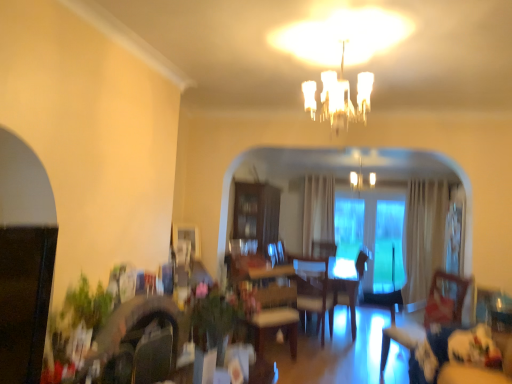
Question: From a real-world perspective, does wooden swivel chair at lower right sit lower than light brown leather armchair at center?

Choices:
 (A) yes
 (B) no

Answer: (B)

Question: Is wooden swivel chair at lower right at the left side of light brown leather armchair at center?

Choices:
 (A) yes
 (B) no

Answer: (B)

Question: Would you say wooden swivel chair at lower right is a long distance from light brown leather armchair at center?

Choices:
 (A) yes
 (B) no

Answer: (A)

Question: Is light brown leather armchair at center at the back of wooden swivel chair at lower right?

Choices:
 (A) yes
 (B) no

Answer: (B)

Question: Could you tell me if wooden swivel chair at lower right is turned towards light brown leather armchair at center?

Choices:
 (A) yes
 (B) no

Answer: (B)

Question: Is wooden swivel chair at lower right smaller than light brown leather armchair at center?

Choices:
 (A) yes
 (B) no

Answer: (B)

Question: From the image's perspective, is transparent glass door at center located beneath white frosted glass chandelier at upper center?

Choices:
 (A) yes
 (B) no

Answer: (A)

Question: Is transparent glass door at center far away from white frosted glass chandelier at upper center?

Choices:
 (A) no
 (B) yes

Answer: (A)

Question: Is transparent glass door at center to the right of white frosted glass chandelier at upper center from the viewer's perspective?

Choices:
 (A) yes
 (B) no

Answer: (A)

Question: Can white frosted glass chandelier at upper center be found inside transparent glass door at center?

Choices:
 (A) no
 (B) yes

Answer: (A)

Question: Does transparent glass door at center have a larger size compared to white frosted glass chandelier at upper center?

Choices:
 (A) yes
 (B) no

Answer: (A)

Question: Considering the relative sizes of transparent glass door at center and white frosted glass chandelier at upper center in the image provided, is transparent glass door at center taller than white frosted glass chandelier at upper center?

Choices:
 (A) no
 (B) yes

Answer: (B)

Question: Considering the relative sizes of white frosted glass chandelier at upper center and velvet blue couch at lower right in the image provided, is white frosted glass chandelier at upper center wider than velvet blue couch at lower right?

Choices:
 (A) yes
 (B) no

Answer: (B)